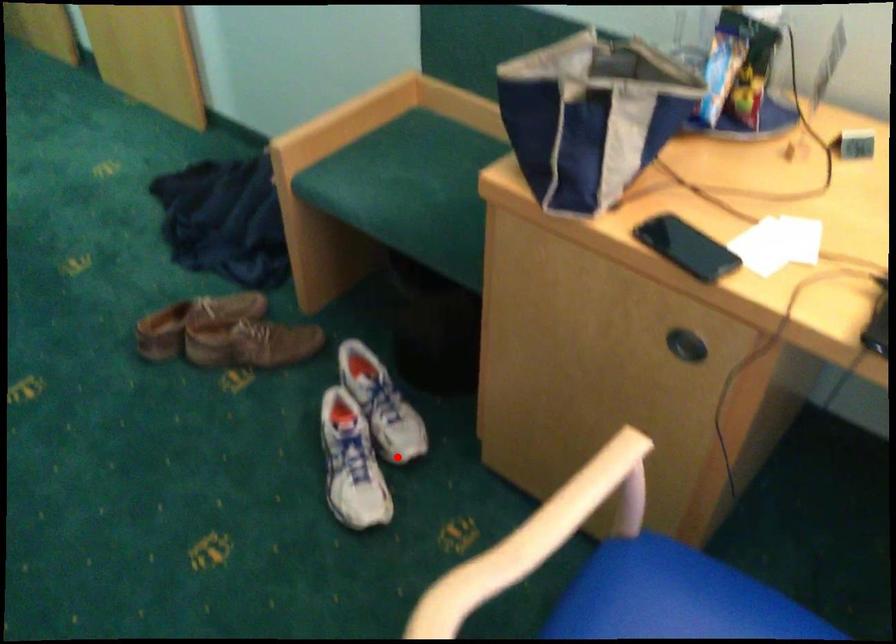
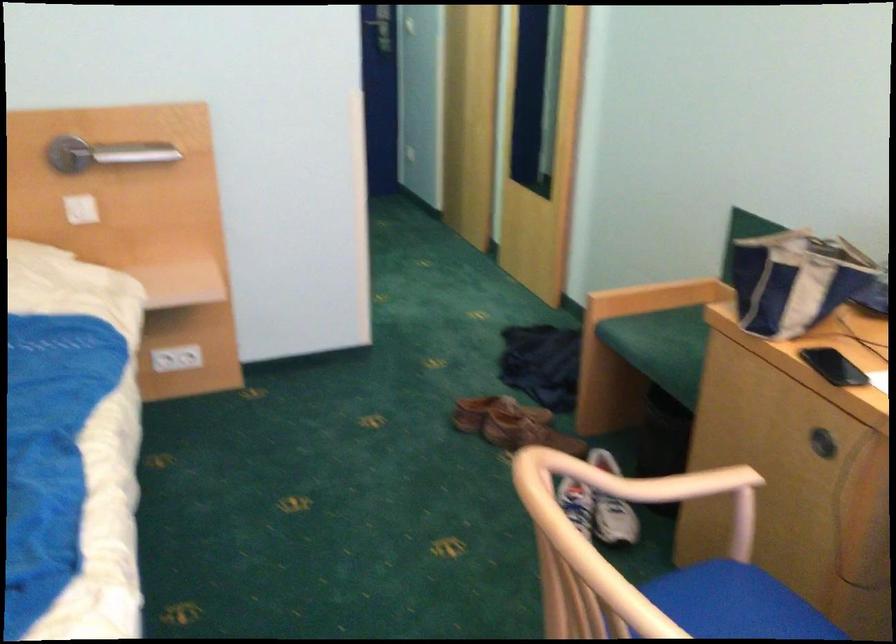
Locate, in the second image, the point that corresponds to the highlighted location in the first image.

(607, 543)